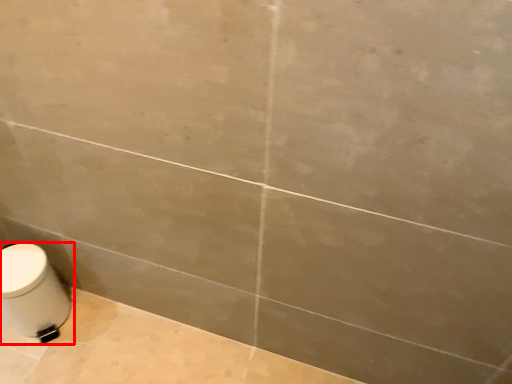
Question: From the image's perspective, what is the correct spatial relationship of toilet (annotated by the red box) in relation to bath?

Choices:
 (A) above
 (B) below

Answer: (B)